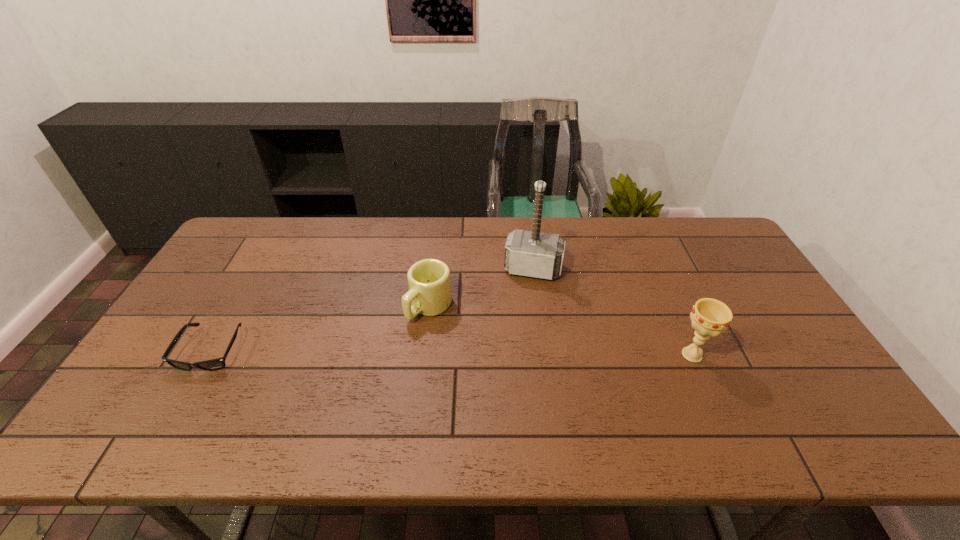
Identify the location of vacant region located 0.360m for striking with the head of the hammer. (509, 378).

What are the coordinates of `free space located for striking with the head of the hammer` in the screenshot? It's located at (514, 356).

Where is `vacant area situated for striking with the head of the hammer`? The height and width of the screenshot is (540, 960). vacant area situated for striking with the head of the hammer is located at coordinates (526, 294).

The height and width of the screenshot is (540, 960). In order to click on free space located with the handle on the side of the second farthest object in this screenshot , I will do `click(355, 379)`.

Find the location of a particular element. This screenshot has height=540, width=960. blank space located 0.140m with the handle on the side of the second farthest object is located at coordinates (380, 355).

Locate an element on the screen. The height and width of the screenshot is (540, 960). vacant area situated 0.160m with the handle on the side of the second farthest object is located at coordinates (374, 361).

Locate an element on the screen. object that is at the far edge is located at coordinates (527, 253).

The image size is (960, 540). What are the coordinates of `object at the left edge` in the screenshot? It's located at (214, 364).

In the image, there is a desktop. Where is `vacant space at the far edge`? vacant space at the far edge is located at coordinates (465, 237).

Locate an element on the screen. free space at the near edge of the desktop is located at coordinates (322, 389).